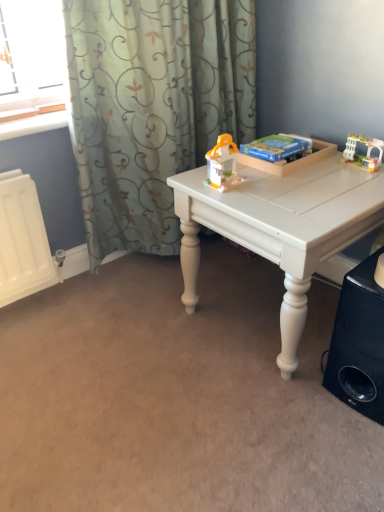
I want to click on blank space above white matte table at center (from a real-world perspective), so click(302, 183).